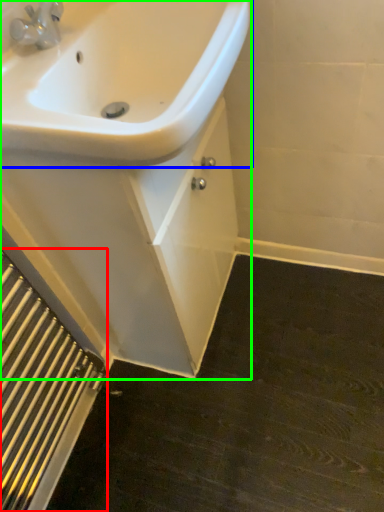
Question: Based on their relative distances, which object is farther from radiator (highlighted by a red box)? Choose from sink (highlighted by a blue box) and porcelain (highlighted by a green box).

Choices:
 (A) sink
 (B) porcelain

Answer: (A)